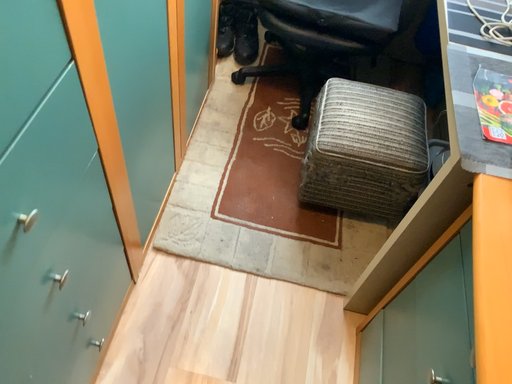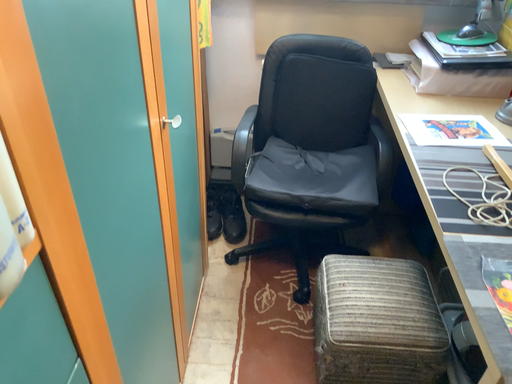
Question: How did the camera likely rotate when shooting the video?

Choices:
 (A) rotated downward
 (B) rotated upward

Answer: (B)